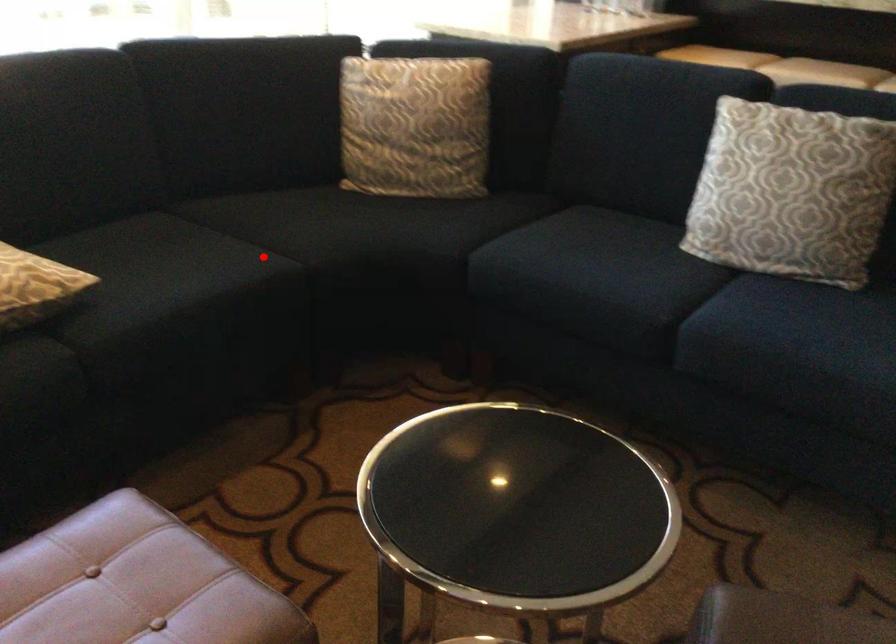
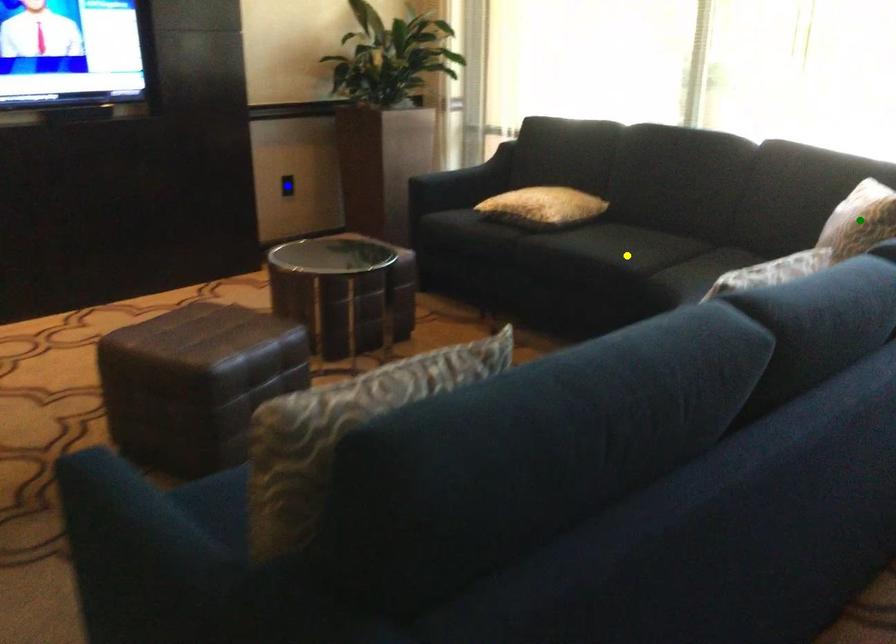
Question: I am providing you with two images of the same scene from different viewpoints. A red point is marked on the first image. You are given multiple points on the second image. In image 2, which mark is for the same physical point as the one in image 1?

Choices:
 (A) blue point
 (B) yellow point
 (C) green point

Answer: (B)